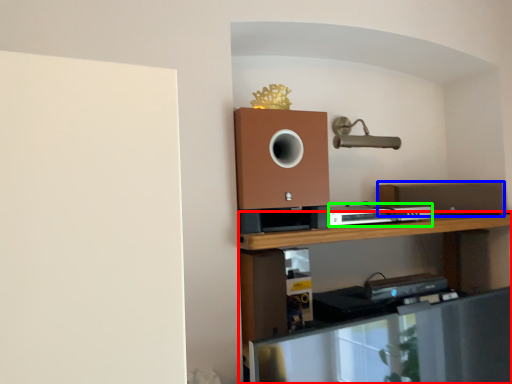
Question: Based on their relative distances, which object is nearer to shelf (highlighted by a red box)? Choose from speaker (highlighted by a blue box) and appliance (highlighted by a green box).

Choices:
 (A) speaker
 (B) appliance

Answer: (B)